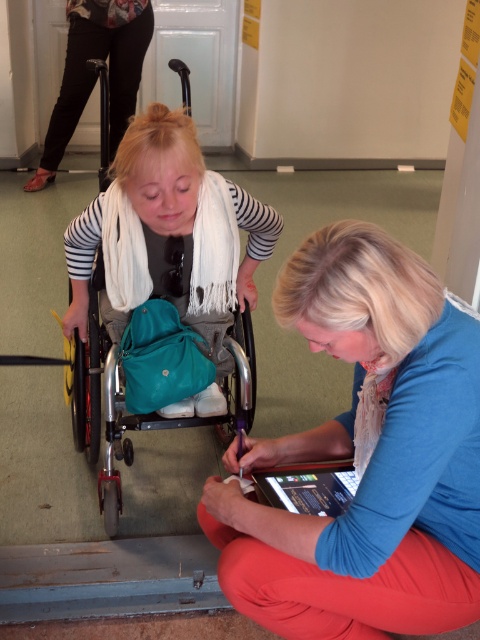
Question: Among these objects, which one is farthest from the camera?

Choices:
 (A) teal fabric wheelchair at center
 (B) blue fabric at lower right

Answer: (A)

Question: Which point is farther to the camera?

Choices:
 (A) (280, 516)
 (B) (92, 298)

Answer: (B)

Question: Does blue fabric at lower right have a smaller size compared to teal fabric wheelchair at center?

Choices:
 (A) yes
 (B) no

Answer: (A)

Question: Which of the following is the farthest from the observer?

Choices:
 (A) (84, 394)
 (B) (277, 525)

Answer: (A)

Question: Observing the image, what is the correct spatial positioning of blue fabric at lower right in reference to teal fabric wheelchair at center?

Choices:
 (A) right
 (B) left

Answer: (A)

Question: Can you confirm if blue fabric at lower right is positioned above teal fabric wheelchair at center?

Choices:
 (A) yes
 (B) no

Answer: (B)